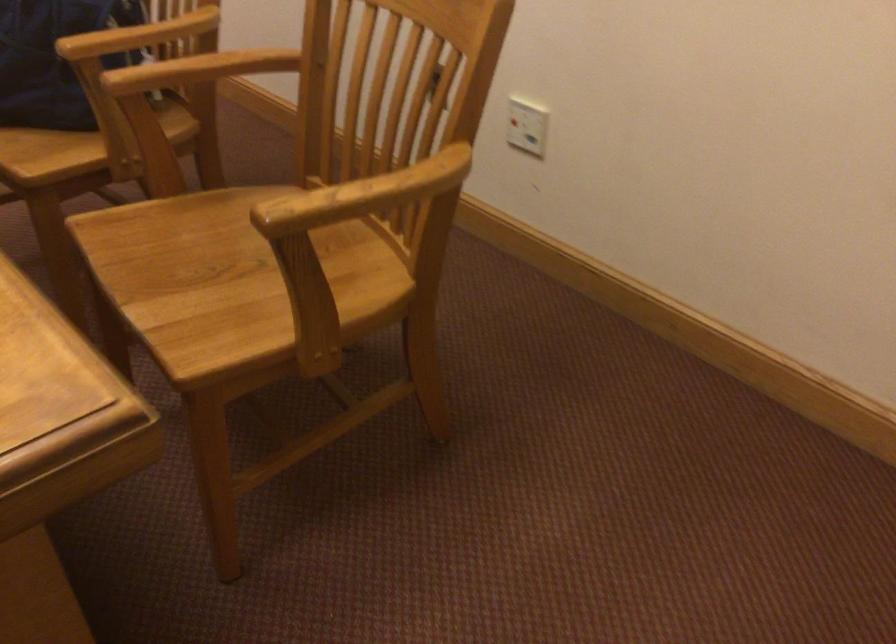
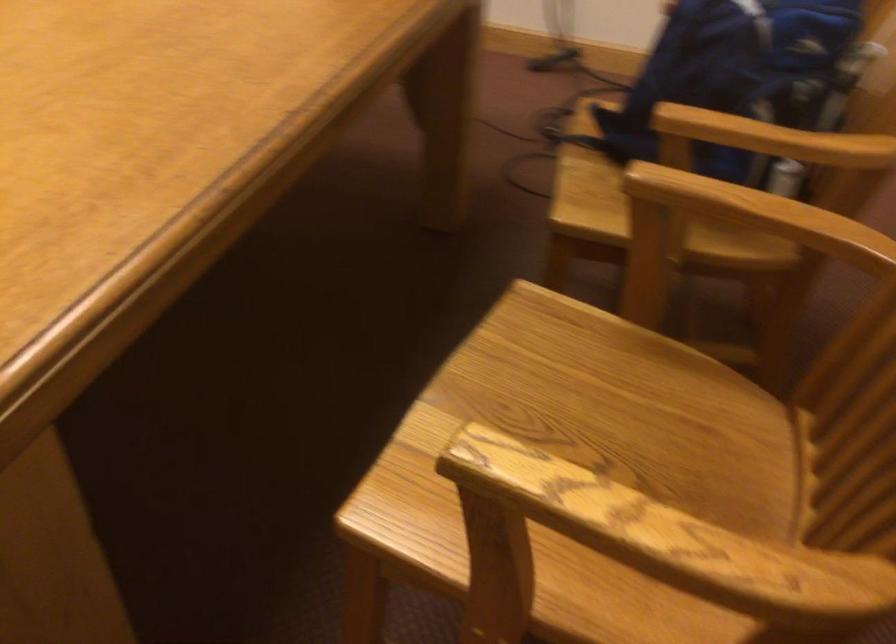
Question: The images are taken continuously from a first-person perspective. In which direction is your viewpoint rotating?

Choices:
 (A) Left
 (B) Right
 (C) Up
 (D) Down

Answer: (A)